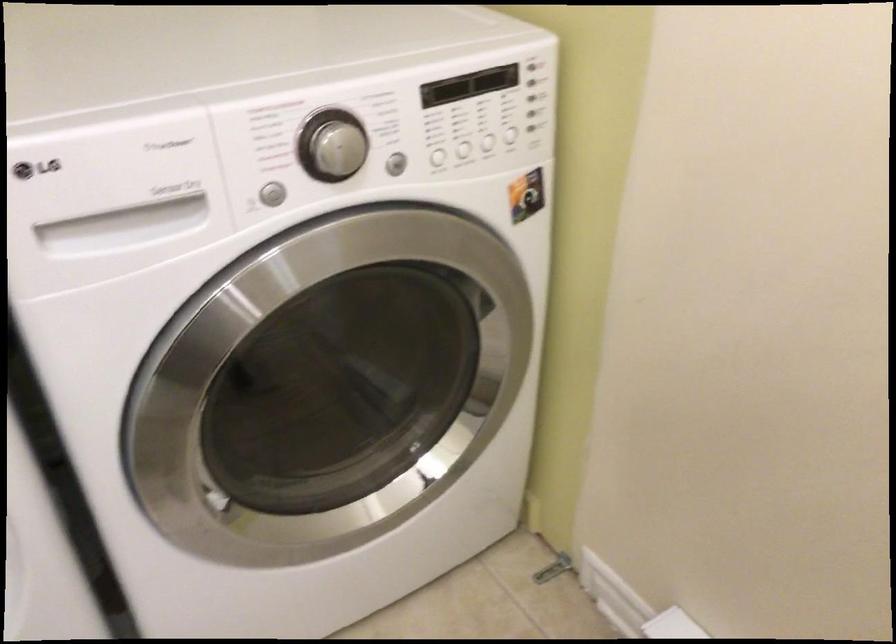
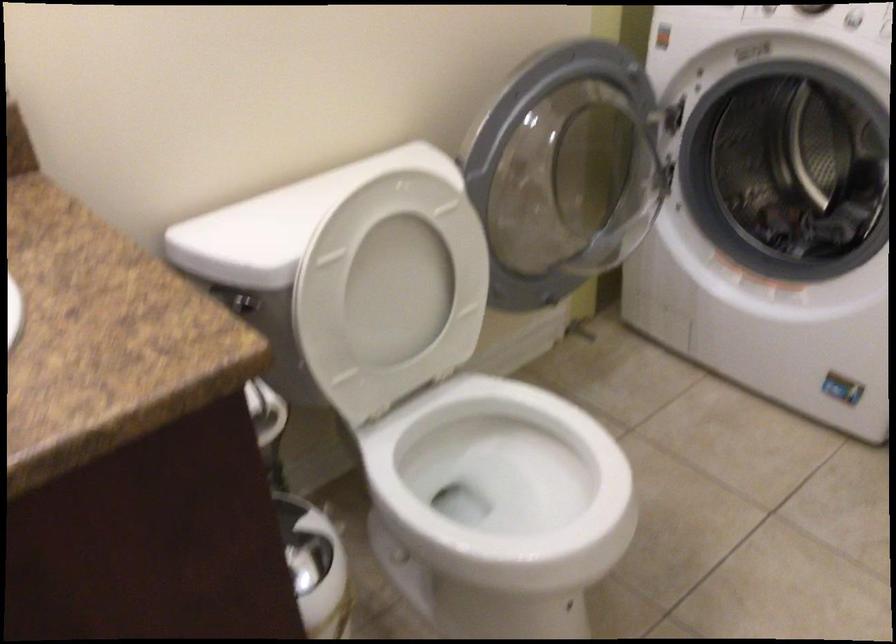
How did the camera likely rotate?

The rotation direction of the camera is left-down.